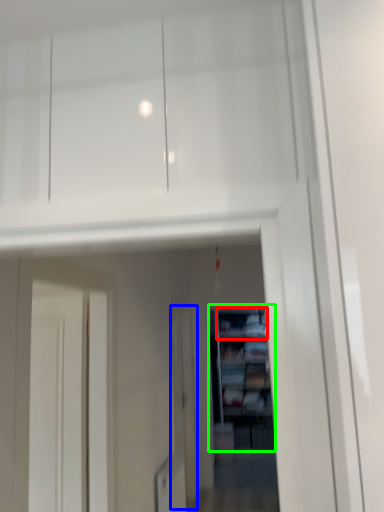
Question: Which is farther away from cabinet (highlighted by a red box)? screen door (highlighted by a blue box) or shelf (highlighted by a green box)?

Choices:
 (A) screen door
 (B) shelf

Answer: (A)